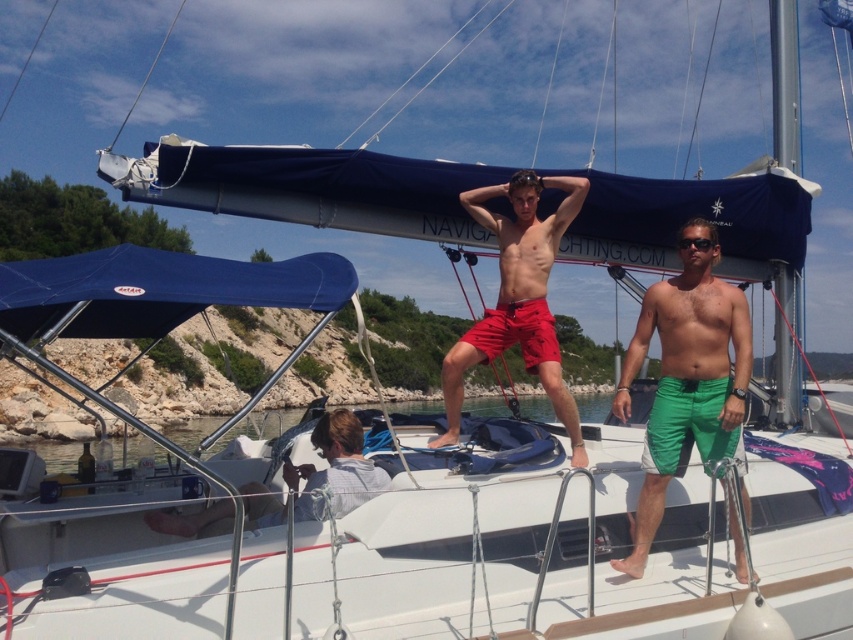
You are a photographer on the boat and want to take a photo of the matte red shorts at center and the black plastic sunglasses at upper center. Which object is closer to the camera lens?

The black plastic sunglasses at upper center is closer to the camera lens because it is positioned above the matte red shorts at center, which is below it.